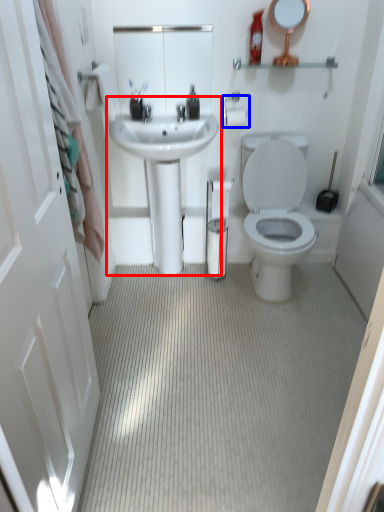
Question: Which object appears closest to the camera in this image, sink (highlighted by a red box) or towel bar (highlighted by a blue box)?

Choices:
 (A) sink
 (B) towel bar

Answer: (A)